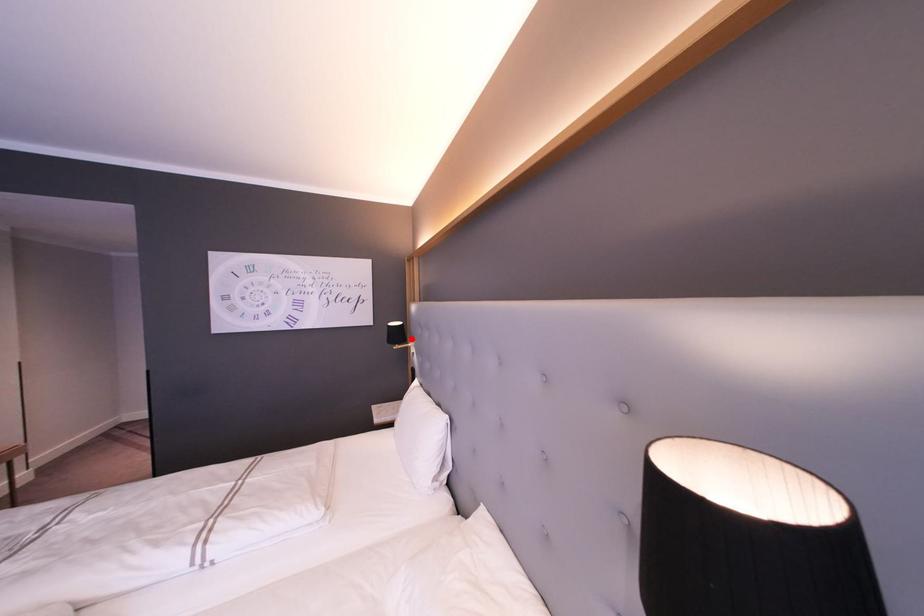
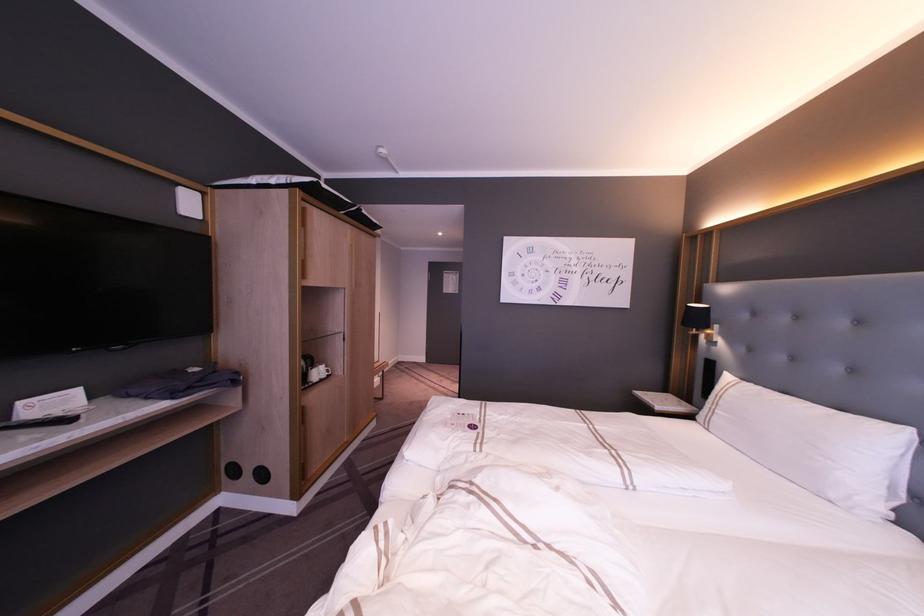
In the second image, find the point that corresponds to the highlighted location in the first image.

(715, 326)